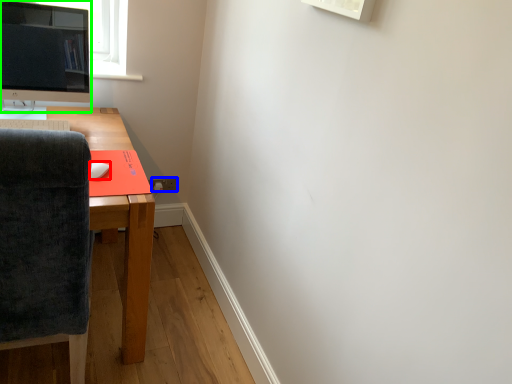
Question: Which object is positioned closest to mouse (highlighted by a red box)? Select from power outlet (highlighted by a blue box) and computer monitor (highlighted by a green box).

Choices:
 (A) power outlet
 (B) computer monitor

Answer: (B)